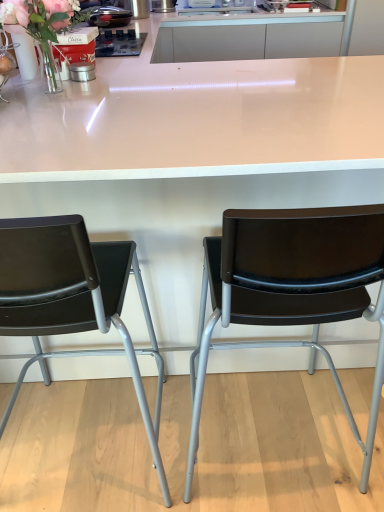
Identify the location of unoccupied area in front of metallic tin at upper left, marked as the third appliance in a top-to-bottom arrangement. This screenshot has width=384, height=512. (75, 82).